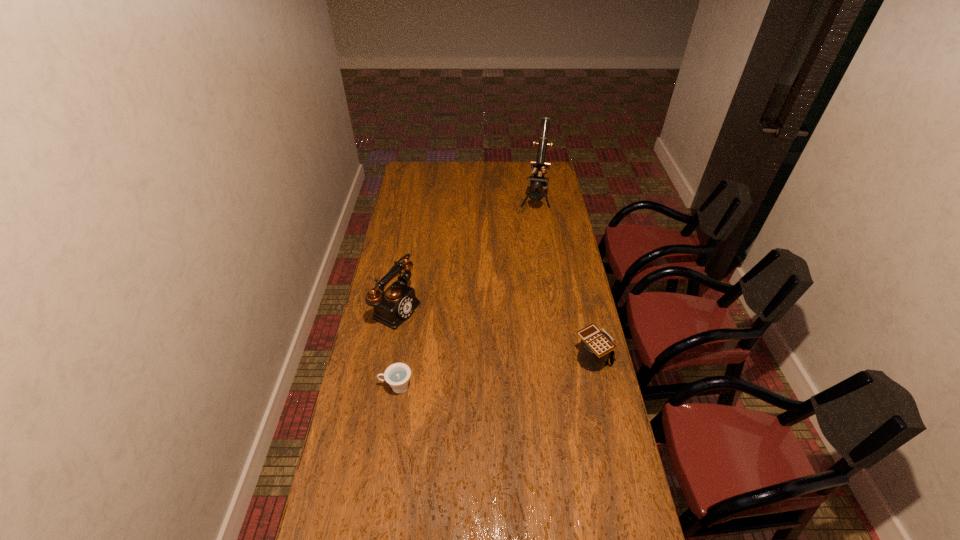
Locate an element on the screen. This screenshot has width=960, height=540. free space between the microscope and the calculator is located at coordinates (564, 280).

Find the location of `free area in between the teacup and the farthest object`. free area in between the teacup and the farthest object is located at coordinates (466, 294).

In order to click on empty space that is in between the third shortest object and the calculator in this screenshot , I will do pyautogui.click(x=495, y=333).

Locate an element on the screen. free point between the telephone and the third tallest object is located at coordinates (495, 333).

Where is `free space between the tallest object and the third nearest object`? The width and height of the screenshot is (960, 540). free space between the tallest object and the third nearest object is located at coordinates (466, 254).

Select which object appears as the third closest to the tallest object. Please provide its 2D coordinates. Your answer should be formatted as a tuple, i.e. [(x, y)], where the tuple contains the x and y coordinates of a point satisfying the conditions above.

[(397, 375)]

Identify the location of the second closest object to the farthest object. This screenshot has height=540, width=960. (596, 347).

At what (x,y) coordinates should I click in order to perform the action: click on vacant space that satisfies the following two spatial constraints: 1. on the front side of the third tallest object; 2. on the right side of the microscope. Please return your answer as a coordinate pair (x, y). The height and width of the screenshot is (540, 960). Looking at the image, I should click on (559, 359).

The width and height of the screenshot is (960, 540). Find the location of `vacant area that satisfies the following two spatial constraints: 1. on the front side of the second tallest object; 2. on the side of the teacup with the handle`. vacant area that satisfies the following two spatial constraints: 1. on the front side of the second tallest object; 2. on the side of the teacup with the handle is located at coordinates (383, 387).

Identify the location of free space that satisfies the following two spatial constraints: 1. on the back side of the tallest object; 2. on the right side of the telephone. This screenshot has width=960, height=540. (417, 200).